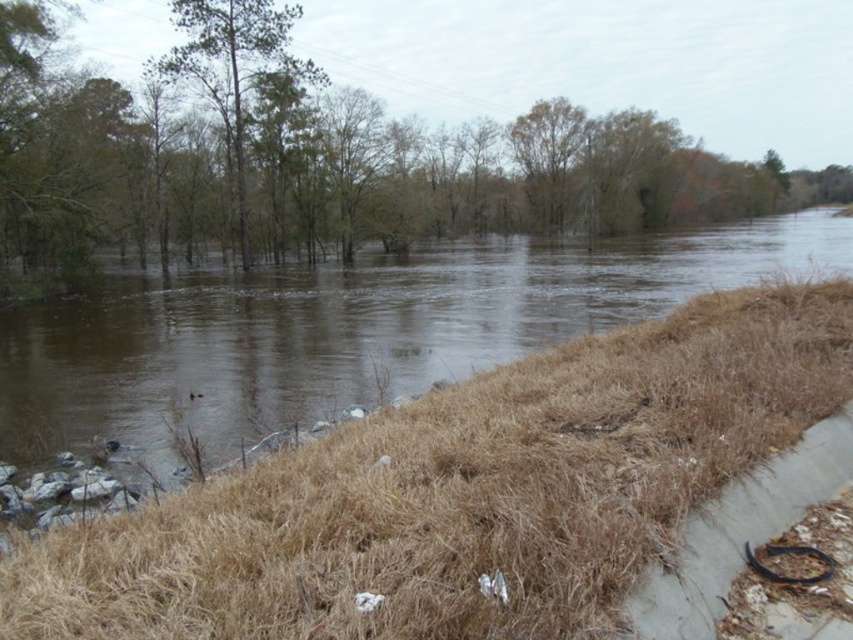
Question: Does brown muddy water at center appear on the right side of gray concrete curb at lower right?

Choices:
 (A) yes
 (B) no

Answer: (A)

Question: Is green leafy tree at upper center wider than brown muddy water at center?

Choices:
 (A) yes
 (B) no

Answer: (A)

Question: Which of the following is the closest to the observer?

Choices:
 (A) (131, 444)
 (B) (357, 125)
 (C) (218, 33)

Answer: (A)

Question: Estimate the real-world distances between objects in this image. Which object is farther from the brown leafy tree at upper center?

Choices:
 (A) brown muddy water at center
 (B) green leafy trees at upper left
 (C) gray concrete curb at lower right

Answer: (C)

Question: Considering the relative positions of brown muddy water at center and green leafy trees at upper left in the image provided, where is brown muddy water at center located with respect to green leafy trees at upper left?

Choices:
 (A) left
 (B) right

Answer: (B)

Question: Considering the real-world distances, which object is closest to the gray concrete curb at lower right?

Choices:
 (A) green leafy trees at upper left
 (B) brown muddy water at center

Answer: (B)